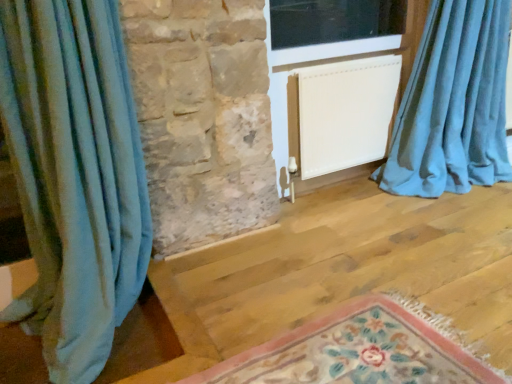
Question: Can you confirm if white matte radiator at center is thinner than blue velvet curtain at right, which ranks as the 1th curtain in right-to-left order?

Choices:
 (A) no
 (B) yes

Answer: (B)

Question: Considering the relative positions of white matte radiator at center and blue velvet curtain at right, which ranks as the 1th curtain in right-to-left order, in the image provided, is white matte radiator at center in front of blue velvet curtain at right, which ranks as the 1th curtain in right-to-left order,?

Choices:
 (A) no
 (B) yes

Answer: (A)

Question: Is white matte radiator at center positioned far away from blue velvet curtain at right, which appears as the 2th curtain when viewed from the left?

Choices:
 (A) no
 (B) yes

Answer: (A)

Question: Is white matte radiator at center shorter than blue velvet curtain at right, which ranks as the 1th curtain in right-to-left order?

Choices:
 (A) yes
 (B) no

Answer: (A)

Question: Considering the relative sizes of white matte radiator at center and blue velvet curtain at right, which appears as the 2th curtain when viewed from the left, in the image provided, is white matte radiator at center smaller than blue velvet curtain at right, which appears as the 2th curtain when viewed from the left,?

Choices:
 (A) no
 (B) yes

Answer: (B)

Question: Is white matte radiator at center further to camera compared to blue velvet curtain at right, which appears as the 2th curtain when viewed from the left?

Choices:
 (A) yes
 (B) no

Answer: (A)

Question: Is floral rug at lower center at the left side of transparent glass window at upper center?

Choices:
 (A) yes
 (B) no

Answer: (A)

Question: Is floral rug at lower center wider than transparent glass window at upper center?

Choices:
 (A) no
 (B) yes

Answer: (B)

Question: From a real-world perspective, is floral rug at lower center under transparent glass window at upper center?

Choices:
 (A) no
 (B) yes

Answer: (B)

Question: Is transparent glass window at upper center at the back of floral rug at lower center?

Choices:
 (A) no
 (B) yes

Answer: (A)

Question: Is floral rug at lower center directly adjacent to transparent glass window at upper center?

Choices:
 (A) no
 (B) yes

Answer: (A)

Question: Does floral rug at lower center have a lesser height compared to transparent glass window at upper center?

Choices:
 (A) no
 (B) yes

Answer: (B)

Question: Does floral rug at lower center touch blue velvet curtain at right, which ranks as the 1th curtain in right-to-left order?

Choices:
 (A) yes
 (B) no

Answer: (B)